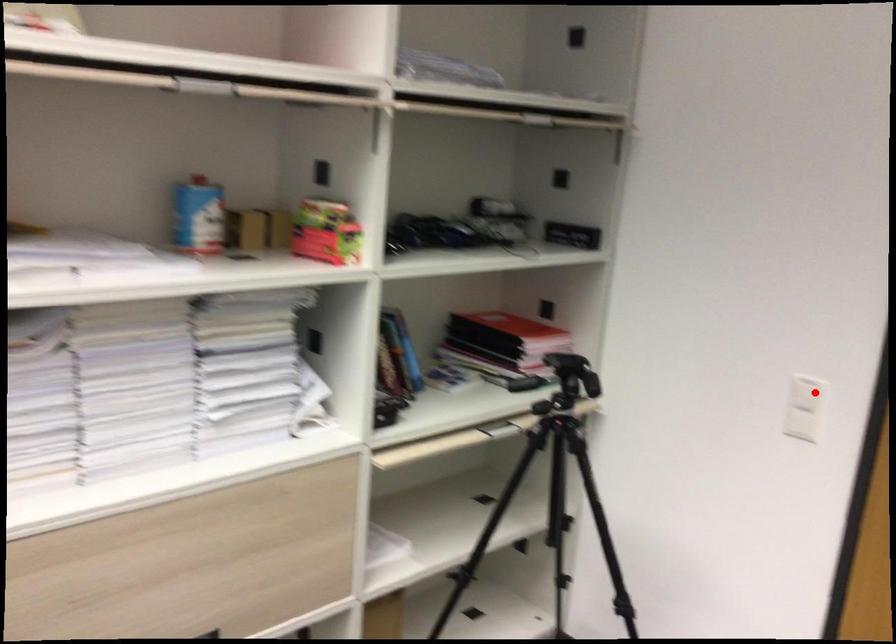
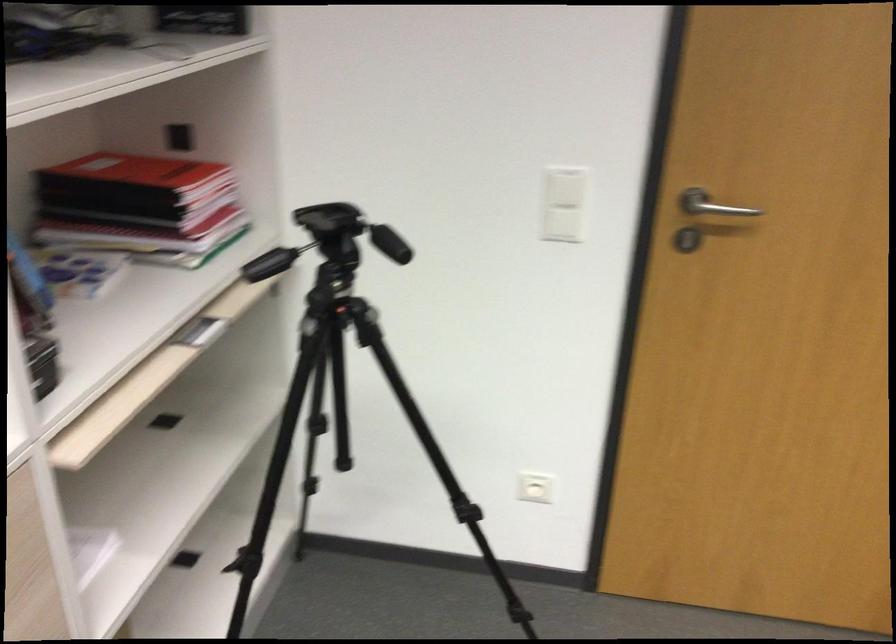
Question: I am providing you with two images of the same scene from different viewpoints. In image1, a red point is highlighted. Considering the same 3D point in image2, which of the following is correct?

Choices:
 (A) It is closer
 (B) It is farther

Answer: (A)